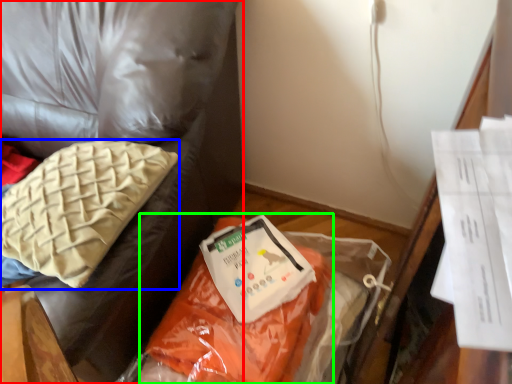
Question: Based on their relative distances, which object is farther from furniture (highlighted by a red box)? Choose from pillow (highlighted by a blue box) and stuff (highlighted by a green box).

Choices:
 (A) pillow
 (B) stuff

Answer: (B)